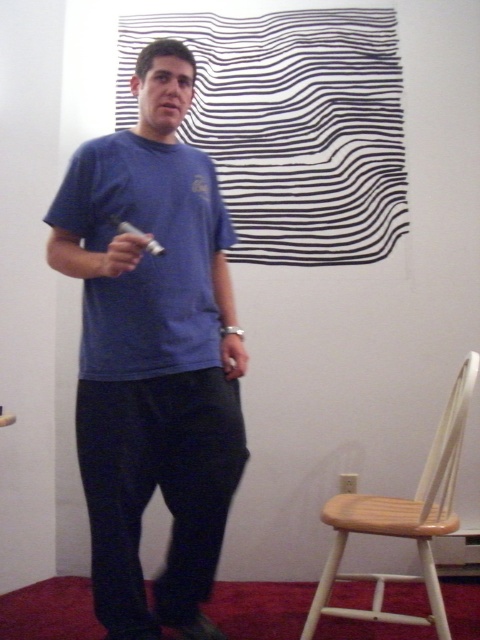
You are trying to place a small plant between the wooden at right and the matte white remote at center. According to the scene, where should you position the plant?

The wooden at right is to the right of the matte white remote at center, so you should place the plant between them on the right side of the matte white remote at center and the left side of the wooden at right.

You are a game developer analyzing a player interaction scene. The scene includes a blue cotton shirt at center and a matte white remote at center. Based on the spatial relationship between these two objects, which one is positioned higher in the image?

The blue cotton shirt at center is taller than the matte white remote at center, so the blue cotton shirt at center is positioned higher in the image.